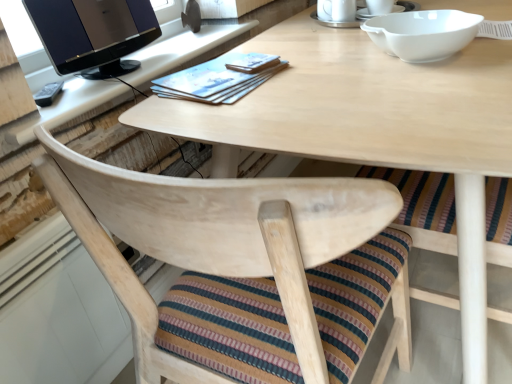
Question: From their relative heights in the image, would you say satin black monitor at upper left is taller or shorter than white ceramic mug at upper center?

Choices:
 (A) tall
 (B) short

Answer: (A)

Question: Is point (61, 41) positioned closer to the camera than point (352, 6)?

Choices:
 (A) farther
 (B) closer

Answer: (B)

Question: Based on their relative distances, which object is nearer to the white ceramic saucer at upper center, the 1th saucer viewed from the left?

Choices:
 (A) white ceramic mug at upper center
 (B) satin black monitor at upper left
 (C) natural wood chair at center
 (D) white ceramic saucer at upper center, positioned as the first saucer in right-to-left order
 (E) white glossy bowl at upper right

Answer: (D)

Question: Estimate the real-world distances between objects in this image. Which object is closer to the white ceramic saucer at upper center, positioned as the first saucer in right-to-left order?

Choices:
 (A) satin black monitor at upper left
 (B) natural wood chair at center
 (C) white glossy bowl at upper right
 (D) white ceramic mug at upper center
 (E) white ceramic saucer at upper center, the 1th saucer viewed from the left

Answer: (E)